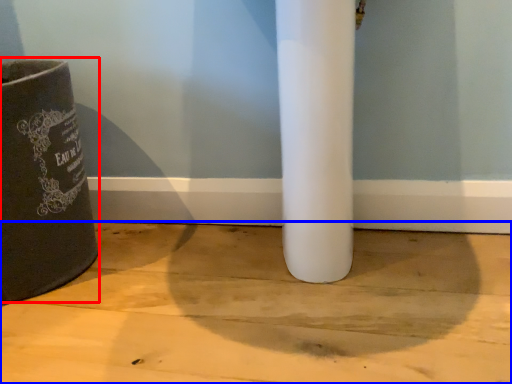
Question: Which point is closer to the camera, waste container (highlighted by a red box) or concrete (highlighted by a blue box)?

Choices:
 (A) waste container
 (B) concrete

Answer: (B)